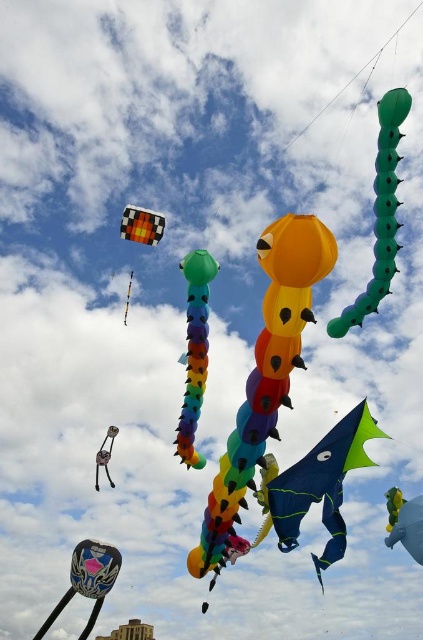
Is the position of green rubber caterpillar at upper right less distant than that of shiny metallic dragon at center?

Yes, green rubber caterpillar at upper right is closer to the viewer.

Does green rubber caterpillar at upper right appear on the left side of shiny metallic dragon at center?

Correct, you'll find green rubber caterpillar at upper right to the left of shiny metallic dragon at center.

The width and height of the screenshot is (423, 640). What do you see at coordinates (381, 212) in the screenshot?
I see `green rubber caterpillar at upper right` at bounding box center [381, 212].

At what (x,y) coordinates should I click in order to perform the action: click on green rubber caterpillar at upper right. Please return your answer as a coordinate pair (x, y). This screenshot has width=423, height=640. Looking at the image, I should click on point(381,212).

Does green rubber caterpillar at upper right have a lesser width compared to metallic silver kite at left?

No, green rubber caterpillar at upper right is not thinner than metallic silver kite at left.

Find the location of a particular element. This screenshot has height=640, width=423. green rubber caterpillar at upper right is located at coordinates (381, 212).

Describe the element at coordinates (381, 212) in the screenshot. This screenshot has height=640, width=423. I see `green rubber caterpillar at upper right` at that location.

Where is `green rubber caterpillar at upper right`? green rubber caterpillar at upper right is located at coordinates (381, 212).

In the scene shown: Who is more forward, (191, 314) or (395, 531)?

Point (191, 314) is in front.

Is rainbow fabric tentacle at center taller than shiny metallic dragon at center?

Correct, rainbow fabric tentacle at center is much taller as shiny metallic dragon at center.

The image size is (423, 640). I want to click on rainbow fabric tentacle at center, so click(x=195, y=352).